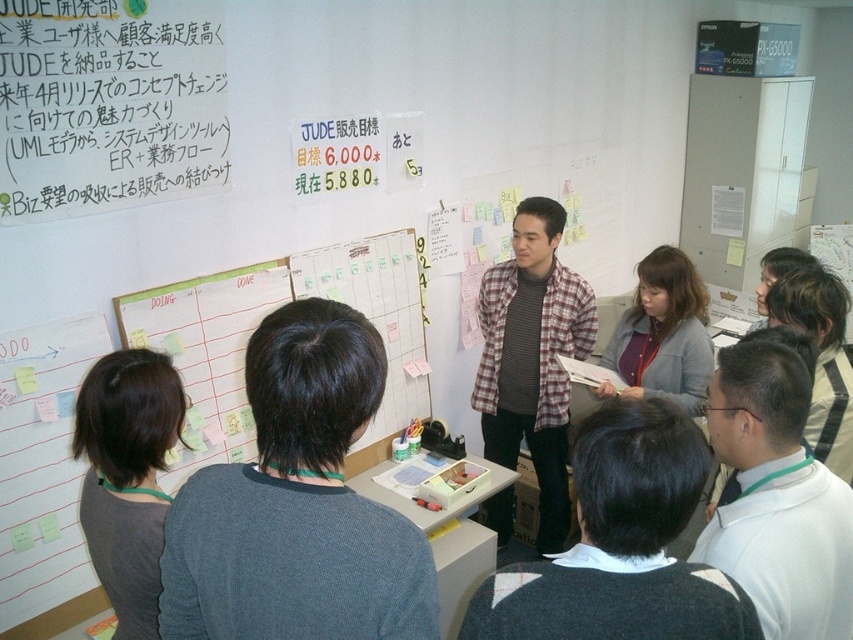
You are a participant in the meeting and need to hand a document to the presenter. The presenter is standing at the center of the room. You are seated at the table. Which object is closer to you, the dark gray sweater at center or the plaid fabric shirt at center?

Result: The dark gray sweater at center is closer to you because it is in front of the plaid fabric shirt at center.

You are an attendee in the meeting. You need to hand a document to the presenter wearing the white matte shirt at center. The document is currently on the matte white paper at upper left. Can you reach it without moving from your seat?

The matte white paper at upper left is to the left of white matte shirt at center. Since the paper is located to the left of the presenter, you can reach it by extending your arm towards the left side of the presenter.

You are standing in the meeting room and see two points marked on the whiteboard. The first point is at coordinates point (410, 568) and the second is at point (822, 506). Which point is closer to you?

Point (410, 568) is closer to the viewer than point (822, 506).